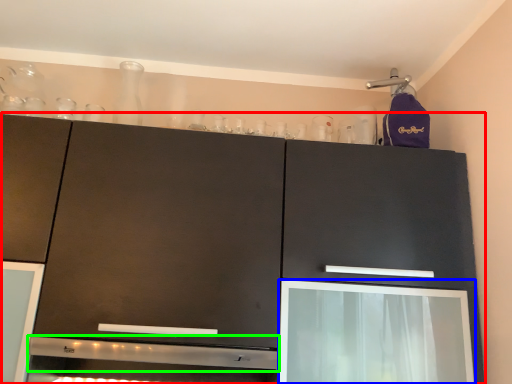
Question: Which object is the farthest from cabinetry (highlighted by a red box)? Choose among these: screen door (highlighted by a blue box) or exhaust hood (highlighted by a green box).

Choices:
 (A) screen door
 (B) exhaust hood

Answer: (B)